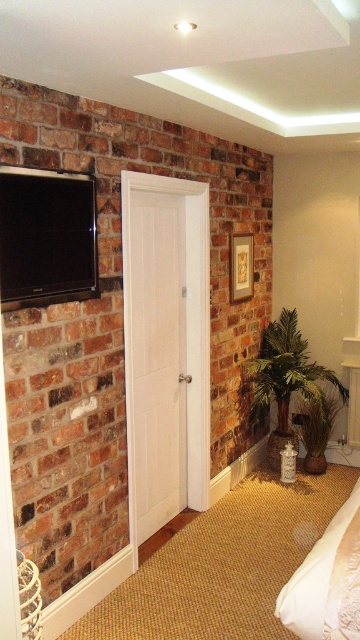
Question: Based on their relative distances, which object is nearer to the matte black flat screen tv at upper left?

Choices:
 (A) white textured bed at lower right
 (B) green leafy plant at lower right

Answer: (A)

Question: Is matte black flat screen tv at upper left to the right of green leafy plant at center from the viewer's perspective?

Choices:
 (A) no
 (B) yes

Answer: (A)

Question: Can you confirm if matte black flat screen tv at upper left is positioned to the right of green leafy plant at center?

Choices:
 (A) no
 (B) yes

Answer: (A)

Question: Is white textured bed at lower right behind green leafy plant at lower right?

Choices:
 (A) no
 (B) yes

Answer: (A)

Question: Which of these objects is positioned farthest from the matte black flat screen tv at upper left?

Choices:
 (A) green leafy plant at lower right
 (B) green leafy plant at center

Answer: (B)

Question: Which of these objects is positioned closest to the green leafy plant at center?

Choices:
 (A) matte black flat screen tv at upper left
 (B) white textured bed at lower right

Answer: (B)